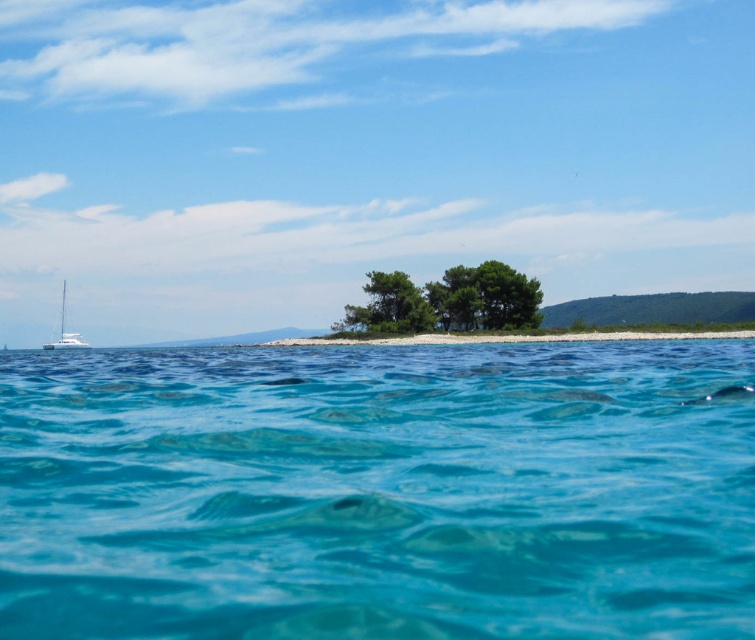
You are a sailor who wants to anchor your boat near the white glossy sailboat at left. Based on the scene, where should you position your boat relative to the clear blue water at center?

The clear blue water at center is below the white glossy sailboat at left, so to anchor your boat near the white glossy sailboat at left, you should position it above the clear blue water at center.

Looking at this image, you are standing on a boat and looking at the clear blue water at center and the green leafy tree at center. Which one is wider?

The clear blue water at center might be wider than green leafy tree at center according to the description.